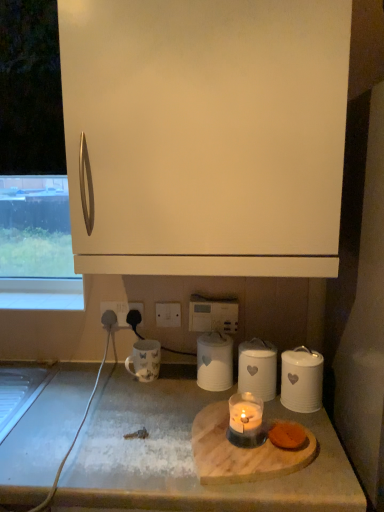
At what (x,y) coordinates should I click in order to perform the action: click on vacant area that lies between translucent glass candle at center and white glossy mug at lower left. Please return your answer as a coordinate pair (x, y). This screenshot has width=384, height=512. Looking at the image, I should click on (170, 398).